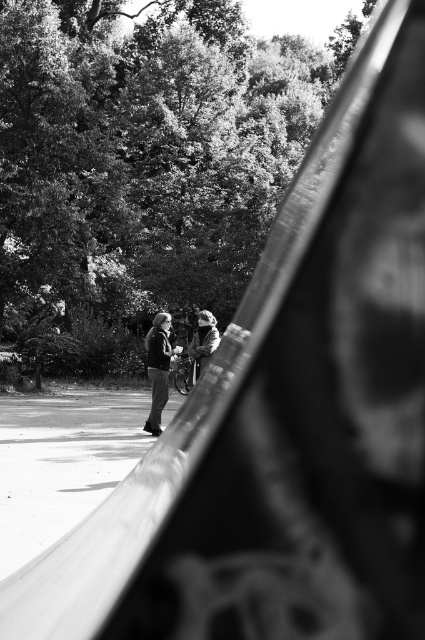
You are a photographer who wants to capture a photo of the two people in the scene. Since the dark gray jacket at center and the light brown leather jacket at center are positioned in a way that might block each other, which jacket should you adjust to ensure both are fully visible in the frame?

The dark gray jacket at center is to the left of the light brown leather jacket at center, so you should move the dark gray jacket at center to the right or the light brown leather jacket at center to the left to ensure both are fully visible without overlapping.